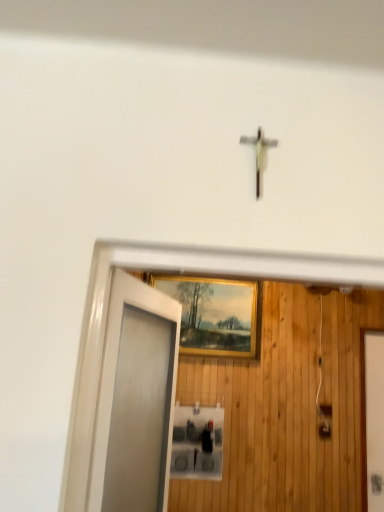
Question: Is frosted glass door at left taller or shorter than white glossy elevator door at right?

Choices:
 (A) tall
 (B) short

Answer: (B)

Question: From a real-world perspective, relative to white glossy elevator door at right, is frosted glass door at left vertically above or below?

Choices:
 (A) above
 (B) below

Answer: (A)

Question: Considering the real-world distances, which object is closest to the white glossy elevator door at right?

Choices:
 (A) gold-framed painting at center
 (B) frosted glass door at left

Answer: (A)

Question: Based on their relative distances, which object is farther from the white glossy elevator door at right?

Choices:
 (A) frosted glass door at left
 (B) gold-framed painting at center

Answer: (A)